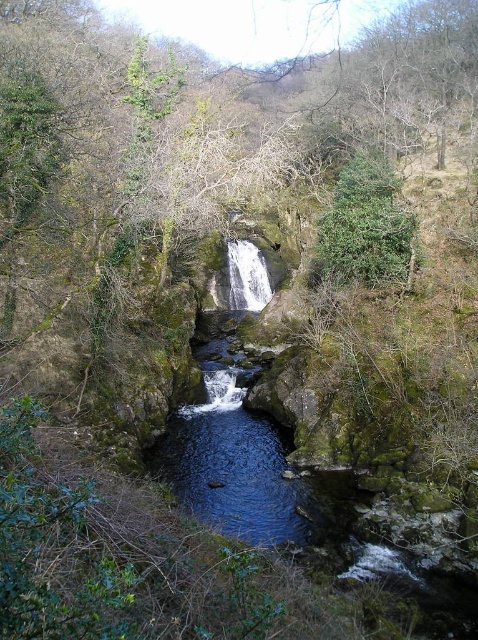
Question: Which point appears closest to the camera in this image?

Choices:
 (A) (208, 323)
 (B) (238, 285)

Answer: (A)

Question: Among these points, which one is nearest to the camera?

Choices:
 (A) (398, 272)
 (B) (232, 355)
 (C) (234, 288)

Answer: (A)

Question: Does dark blue rock at center have a greater width compared to white textured waterfall at center?

Choices:
 (A) yes
 (B) no

Answer: (A)

Question: Can you confirm if green leafy tree at upper center is positioned to the left of white textured waterfall at center?

Choices:
 (A) no
 (B) yes

Answer: (A)

Question: Observing the image, what is the correct spatial positioning of green leafy tree at upper center in reference to white textured waterfall at center?

Choices:
 (A) below
 (B) above

Answer: (B)

Question: Which object is farther from the camera taking this photo?

Choices:
 (A) green leafy tree at upper center
 (B) dark blue rock at center
 (C) white textured waterfall at center

Answer: (C)